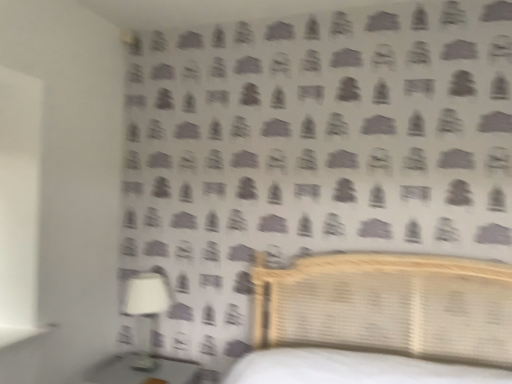
What is the approximate height of wooden bed at center?

29.73 inches.

In order to face wooden bed at center, should I rotate leftwards or rightwards?

To align with it, rotate right about 5.718°.

Where is `wooden bed at center`? The width and height of the screenshot is (512, 384). wooden bed at center is located at coordinates (388, 306).

Describe the element at coordinates (388, 306) in the screenshot. I see `wooden bed at center` at that location.

Find the location of `wooden bed at center`. wooden bed at center is located at coordinates (388, 306).